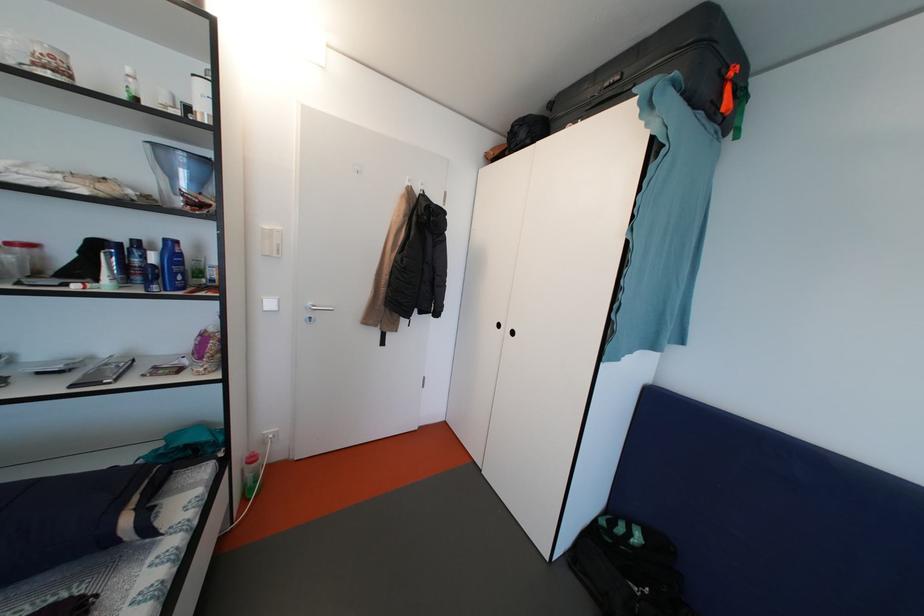
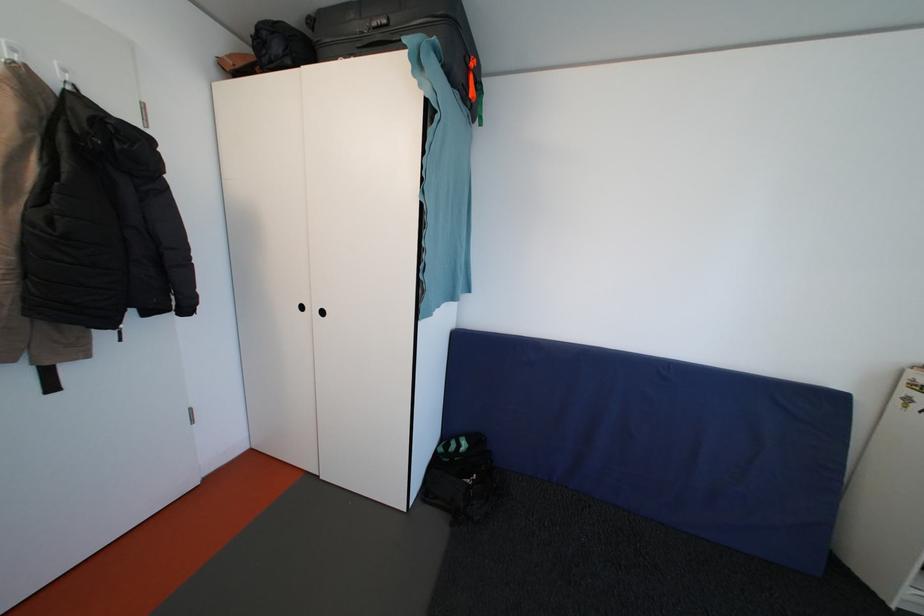
Question: The camera is either moving clockwise (left) or counter-clockwise (right) around the object. The first image is from the beginning of the video and the second image is from the end. Is the camera moving left or right when shooting the video?

Choices:
 (A) Left
 (B) Right

Answer: (A)